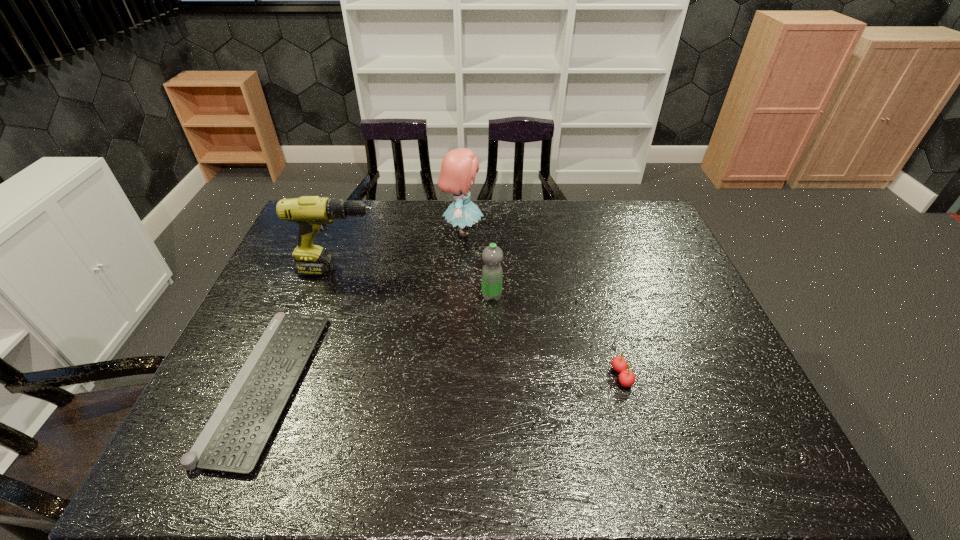
This screenshot has height=540, width=960. Identify the location of vacant region located 0.390m on the left of the cherry. (451, 376).

The width and height of the screenshot is (960, 540). What are the coordinates of `free space located on the right of the computer keyboard` in the screenshot? It's located at (434, 384).

At what (x,y) coordinates should I click in order to perform the action: click on object that is at the far edge. Please return your answer as a coordinate pair (x, y). This screenshot has width=960, height=540. Looking at the image, I should click on (459, 166).

In order to click on object present at the near edge in this screenshot , I will do `click(233, 440)`.

This screenshot has height=540, width=960. What are the coordinates of `drill that is at the left edge` in the screenshot? It's located at (312, 213).

The height and width of the screenshot is (540, 960). I want to click on computer keyboard positioned at the left edge, so click(233, 440).

Image resolution: width=960 pixels, height=540 pixels. What are the coordinates of `object that is at the near left corner` in the screenshot? It's located at (233, 440).

Where is `vacant region at the far edge`? vacant region at the far edge is located at coordinates (446, 226).

Image resolution: width=960 pixels, height=540 pixels. In order to click on vacant space at the right edge of the desktop in this screenshot , I will do `click(703, 357)`.

In the image, there is a desktop. Where is `vacant space at the far right corner`? vacant space at the far right corner is located at coordinates (616, 222).